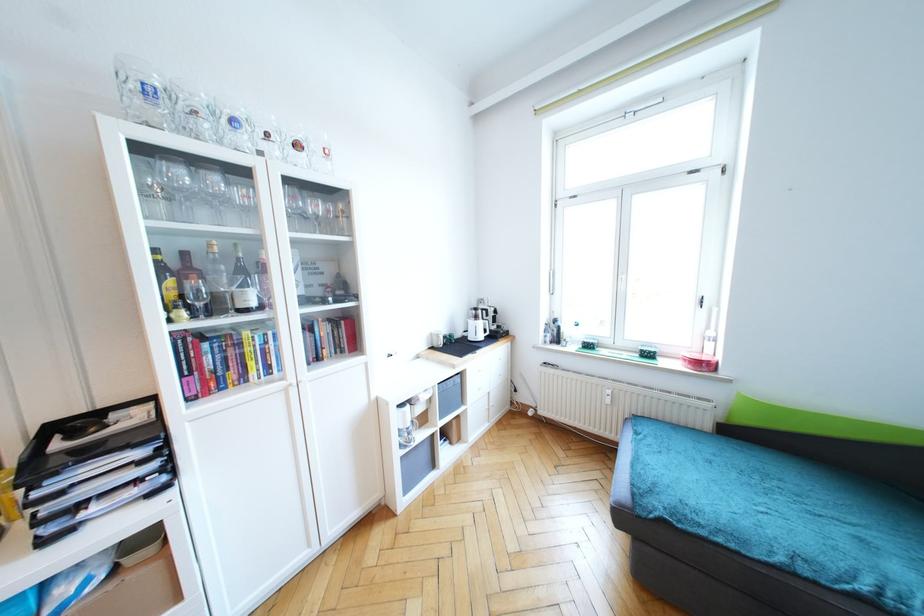
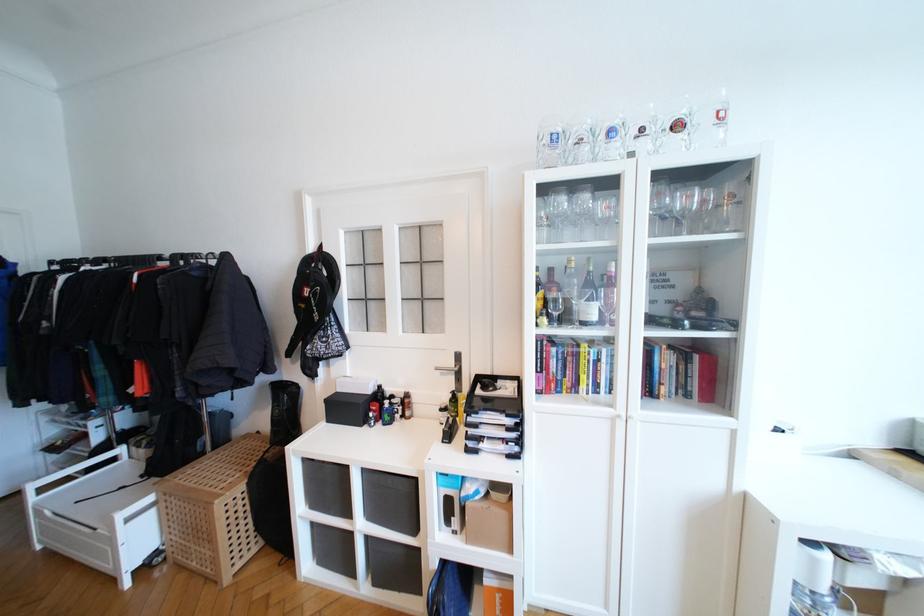
Question: How did the camera likely rotate?

Choices:
 (A) Left
 (B) Right
 (C) Up
 (D) Down

Answer: (A)